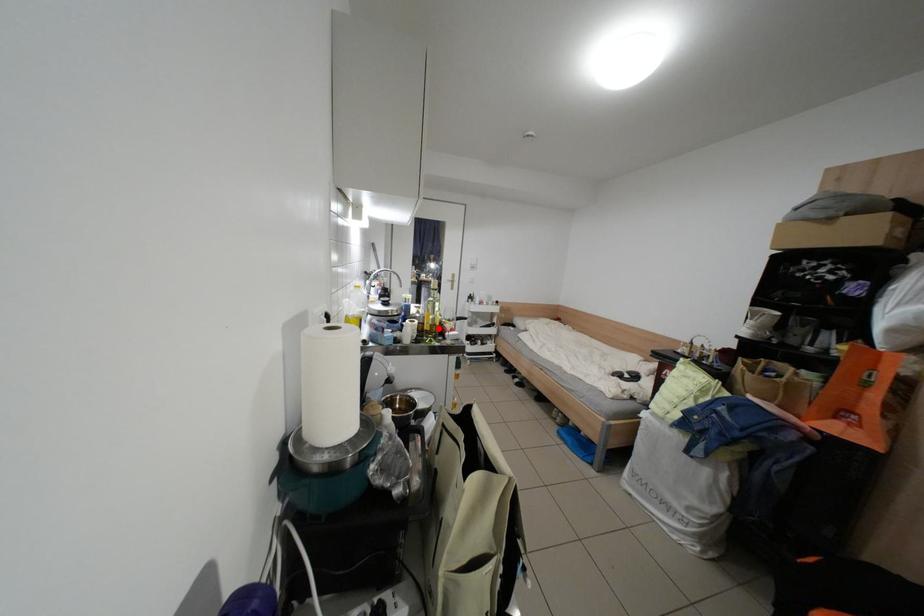
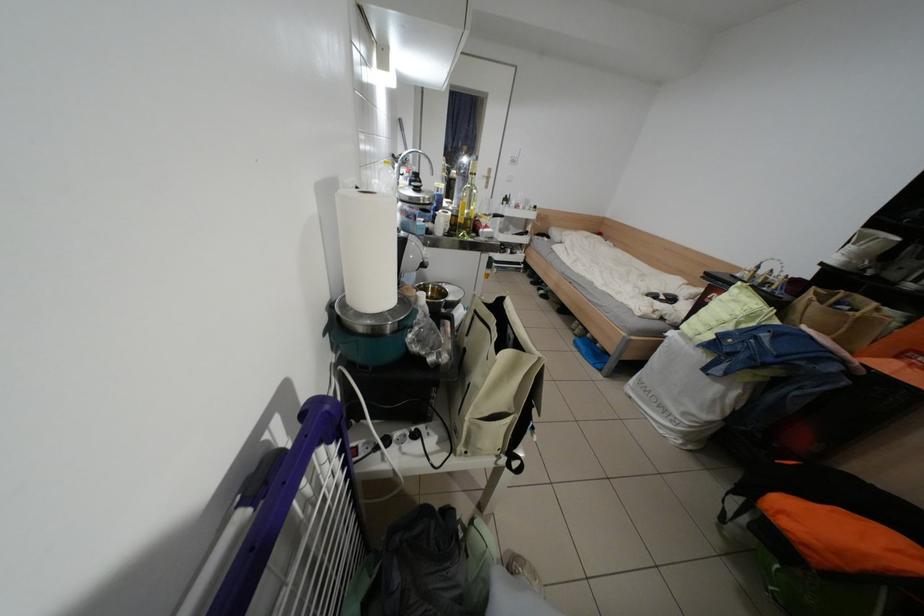
The point at the highlighted location is marked in the first image. Where is the corresponding point in the second image?

(472, 222)